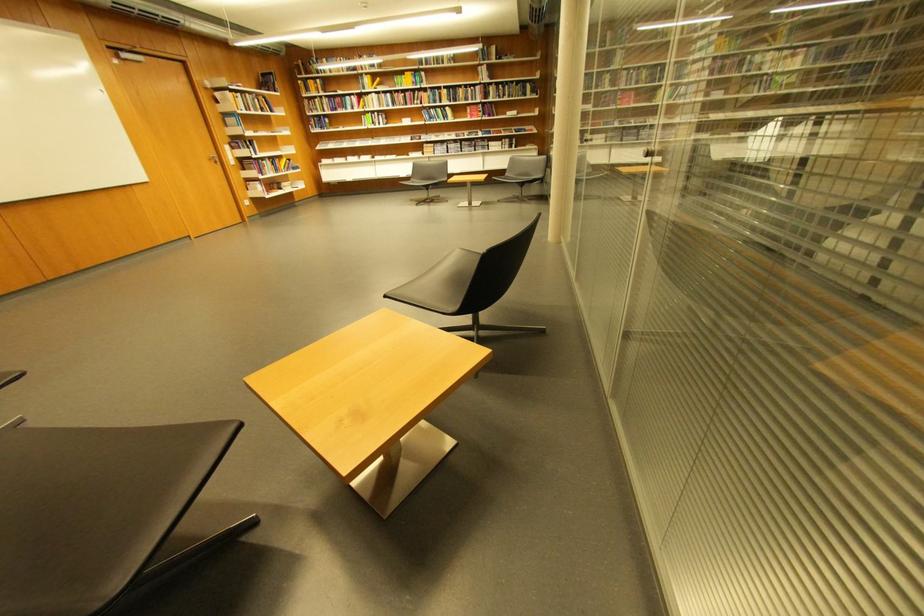
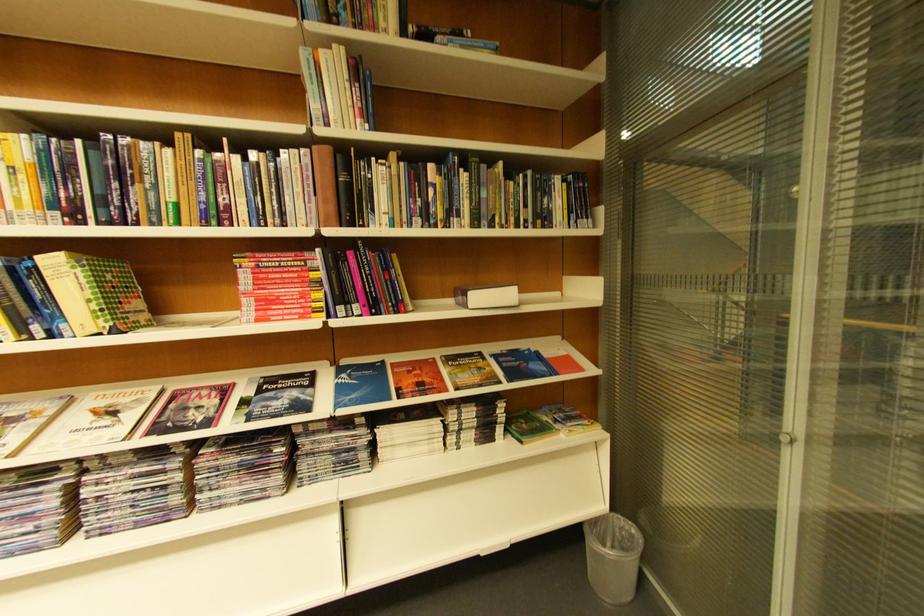
Locate, in the second image, the point that corresponds to (x=535, y=95) in the first image.

(554, 221)